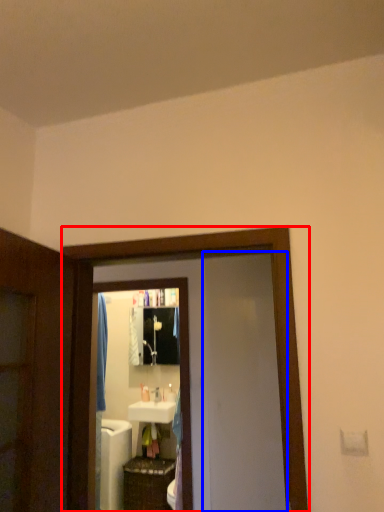
Question: Which object appears closest to the camera in this image, screen door (highlighted by a red box) or screen door (highlighted by a blue box)?

Choices:
 (A) screen door
 (B) screen door

Answer: (A)